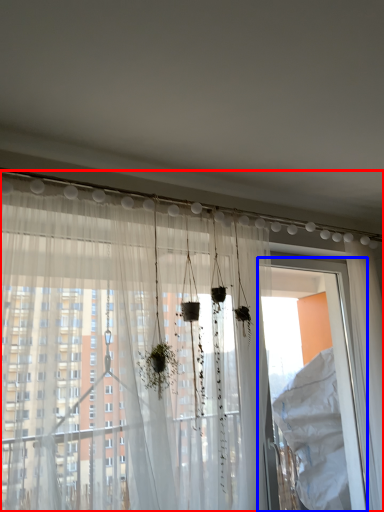
Question: Among these objects, which one is nearest to the camera, curtain (highlighted by a red box) or screen door (highlighted by a blue box)?

Choices:
 (A) curtain
 (B) screen door

Answer: (A)